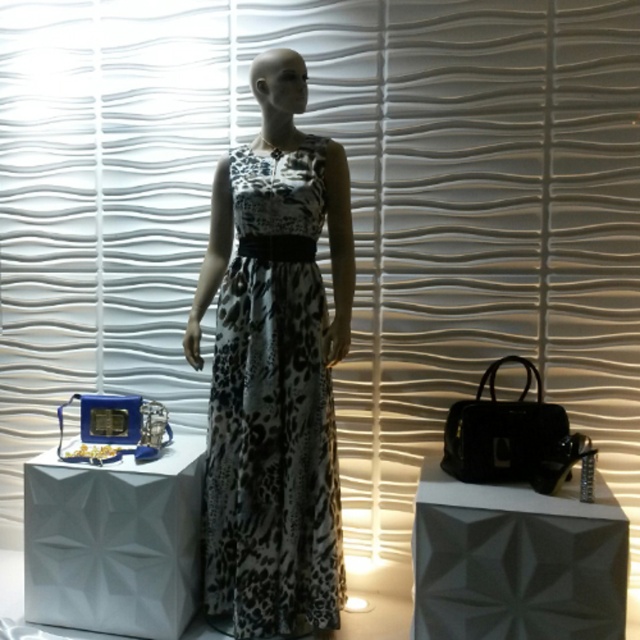
You are a store manager checking the layout of your boutique. You see the black printed fabric dress at center and the white matte box at lower left. Which object takes up more space in the store?

The black printed fabric dress at center is bigger than the white matte box at lower left, so it takes up more space in the store.

You are standing in front of the mannequin and want to place a small sticker on the point that is closer to you. Which point should you choose between point (236, 244) and point (104, 477)?

Point (104, 477) is closer to you than point (236, 244), so you should choose point (104, 477) to place the sticker.